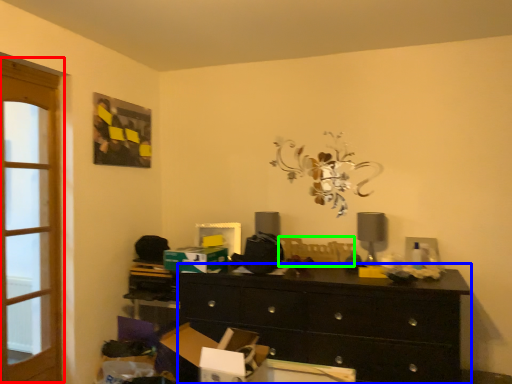
Question: Based on their relative distances, which object is nearer to screen door (highlighted by a red box)? Choose from chest of drawers (highlighted by a blue box) and swivel chair (highlighted by a green box).

Choices:
 (A) chest of drawers
 (B) swivel chair

Answer: (A)